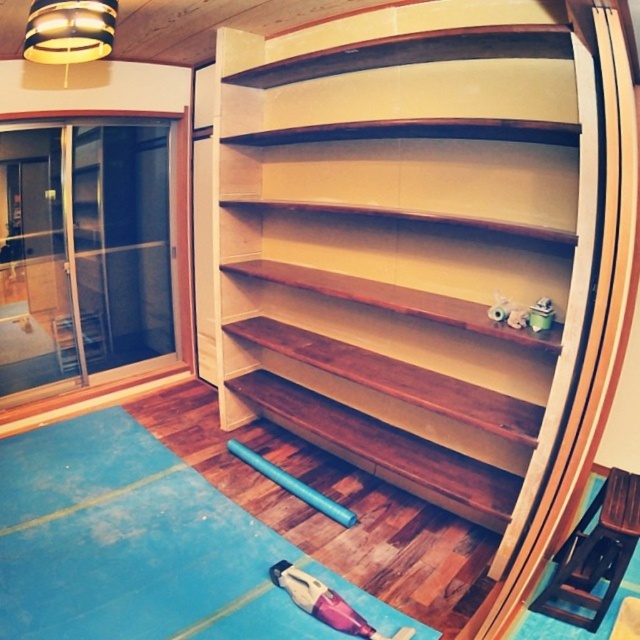
Who is more forward, (627, 202) or (189, 612)?

Point (627, 202) is more forward.

Who is taller, wooden shelves at center or blue rubber mat at lower center?

Standing taller between the two is wooden shelves at center.

The width and height of the screenshot is (640, 640). What do you see at coordinates (433, 253) in the screenshot?
I see `wooden shelves at center` at bounding box center [433, 253].

Locate an element on the screen. wooden shelves at center is located at coordinates (433, 253).